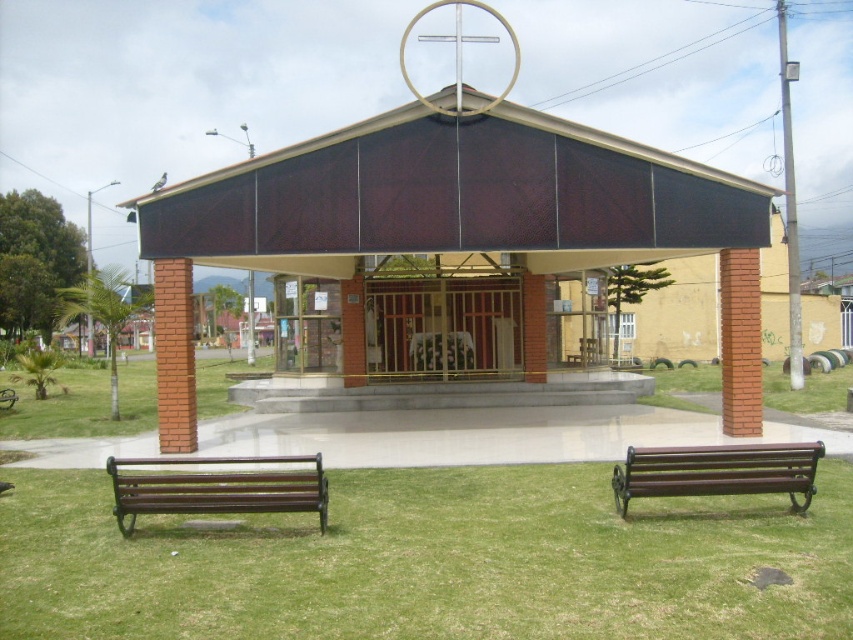
Question: Considering the real-world distances, which object is farthest from the metallic gate at center?

Choices:
 (A) brown polished wood bench at lower left
 (B) brown wooden bench at lower right
 (C) matte brown chapel at center

Answer: (A)

Question: Estimate the real-world distances between objects in this image. Which object is closer to the matte brown chapel at center?

Choices:
 (A) green grass at lower center
 (B) brown polished wood bench at lower left
 (C) metallic gate at center

Answer: (C)

Question: Which of the following is the farthest from the observer?

Choices:
 (A) pos(387,298)
 (B) pos(161,508)

Answer: (A)

Question: Is green grass at lower center smaller than metallic gate at center?

Choices:
 (A) yes
 (B) no

Answer: (A)

Question: Is green grass at lower center wider than brown polished wood bench at lower left?

Choices:
 (A) yes
 (B) no

Answer: (B)

Question: Is green grass at lower center wider than metallic gate at center?

Choices:
 (A) yes
 (B) no

Answer: (B)